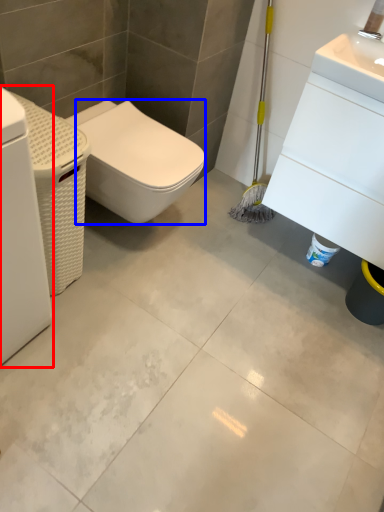
Question: Which object is further to the camera taking this photo, washing machine (highlighted by a red box) or bidet (highlighted by a blue box)?

Choices:
 (A) washing machine
 (B) bidet

Answer: (B)